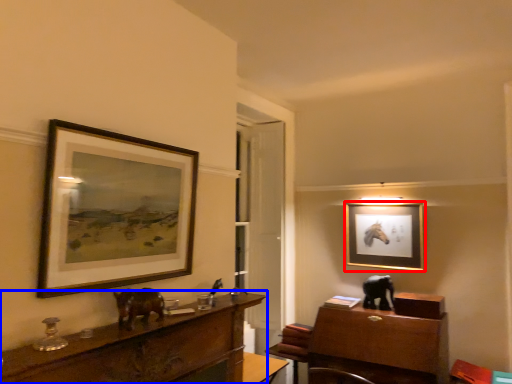
Question: Among these objects, which one is farthest to the camera, picture frame (highlighted by a red box) or desk (highlighted by a blue box)?

Choices:
 (A) picture frame
 (B) desk

Answer: (A)